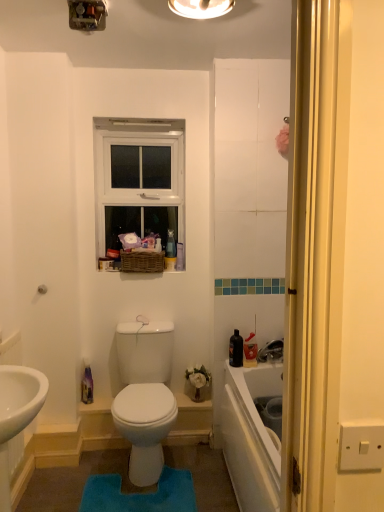
Question: From a real-world perspective, is white plastic window at upper center under blue plush bath mat at center?

Choices:
 (A) yes
 (B) no

Answer: (B)

Question: Can blue plush bath mat at center be found inside white plastic window at upper center?

Choices:
 (A) no
 (B) yes

Answer: (A)

Question: Does white plastic window at upper center lie behind blue plush bath mat at center?

Choices:
 (A) yes
 (B) no

Answer: (A)

Question: Does white plastic window at upper center have a greater height compared to blue plush bath mat at center?

Choices:
 (A) yes
 (B) no

Answer: (A)

Question: Can you confirm if white plastic window at upper center is positioned to the right of blue plush bath mat at center?

Choices:
 (A) yes
 (B) no

Answer: (B)

Question: Is white plastic window at upper center outside blue plush bath mat at center?

Choices:
 (A) yes
 (B) no

Answer: (A)

Question: Is white plastic window at upper center oriented away from matte white light fixture at upper center, arranged as the first light fixture when viewed from the right?

Choices:
 (A) no
 (B) yes

Answer: (A)

Question: Does white plastic window at upper center appear on the left side of matte white light fixture at upper center, arranged as the second light fixture when viewed from the left?

Choices:
 (A) yes
 (B) no

Answer: (A)

Question: From the image's perspective, is white plastic window at upper center above matte white light fixture at upper center, arranged as the first light fixture when viewed from the right?

Choices:
 (A) yes
 (B) no

Answer: (B)

Question: Considering the relative sizes of white plastic window at upper center and matte white light fixture at upper center, arranged as the second light fixture when viewed from the left, in the image provided, is white plastic window at upper center wider than matte white light fixture at upper center, arranged as the second light fixture when viewed from the left,?

Choices:
 (A) yes
 (B) no

Answer: (B)

Question: From a real-world perspective, is white plastic window at upper center below matte white light fixture at upper center, arranged as the second light fixture when viewed from the left?

Choices:
 (A) no
 (B) yes

Answer: (B)

Question: Can we say white plastic window at upper center lies outside matte white light fixture at upper center, arranged as the second light fixture when viewed from the left?

Choices:
 (A) no
 (B) yes

Answer: (B)

Question: From the image's perspective, is metallic switchplate at upper center, which appears as the first light fixture when viewed from the left, below matte white light fixture at upper center, arranged as the first light fixture when viewed from the right?

Choices:
 (A) yes
 (B) no

Answer: (A)